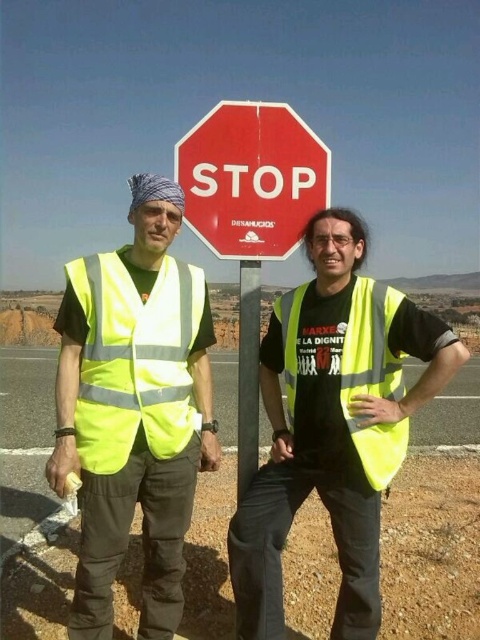
You are a safety inspector evaluating the visibility of safety gear in the image. You notice two yellow vests, the neon yellow reflective vest at left and the high visibility yellow safety vest at center. Which one has a larger size?

The neon yellow reflective vest at left has a larger size compared to the high visibility yellow safety vest at center.

You are a pedestrian trying to cross the street and see the neon yellow reflective vest at left and the red matte stop sign at center. According to the scene, which object is positioned lower from your viewpoint?

The neon yellow reflective vest at left is positioned below the red matte stop sign at center, so the neon yellow reflective vest at left is lower from your viewpoint.

You are a pedestrian trying to cross the street near the red STOP sign. There is a neon yellow reflective vest at left represented by point (133, 410). Where is the neon yellow reflective vest at left located relative to the STOP sign?

The neon yellow reflective vest at left is located at point (133, 410) relative to the STOP sign.